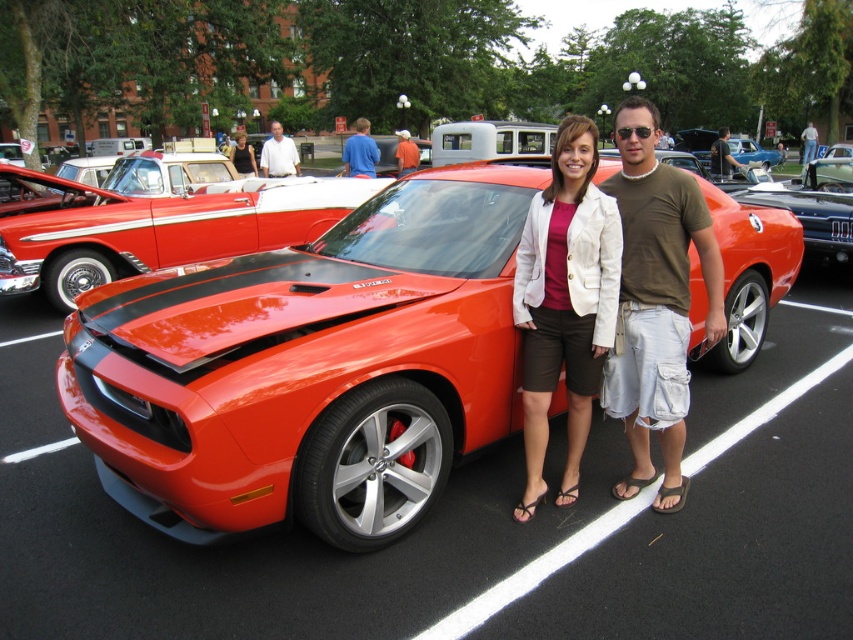
Which is more to the left, matte white blazer at center or glossy black car at center?

matte white blazer at center

Who is more forward, (554, 358) or (831, 179)?

Point (554, 358) is more forward.

Identify the location of matte white blazer at center. (564, 304).

Does matte white blazer at center appear on the left side of white smooth shirt at center?

In fact, matte white blazer at center is to the right of white smooth shirt at center.

Which is more to the left, matte white blazer at center or white smooth shirt at center?

white smooth shirt at center is more to the left.

At what (x,y) coordinates should I click in order to perform the action: click on matte white blazer at center. Please return your answer as a coordinate pair (x, y). This screenshot has width=853, height=640. Looking at the image, I should click on (564, 304).

Describe the element at coordinates (277, 154) in the screenshot. I see `white smooth shirt at center` at that location.

Who is more forward, (x=274, y=129) or (x=405, y=132)?

Point (x=274, y=129) is more forward.

Identify the location of white smooth shirt at center. (277, 154).